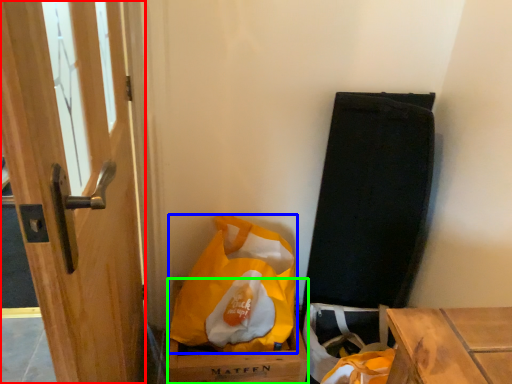
Question: Based on their relative distances, which object is nearer to door (highlighted by a red box)? Choose from plastic bag (highlighted by a blue box) and cardboard box (highlighted by a green box).

Choices:
 (A) plastic bag
 (B) cardboard box

Answer: (A)